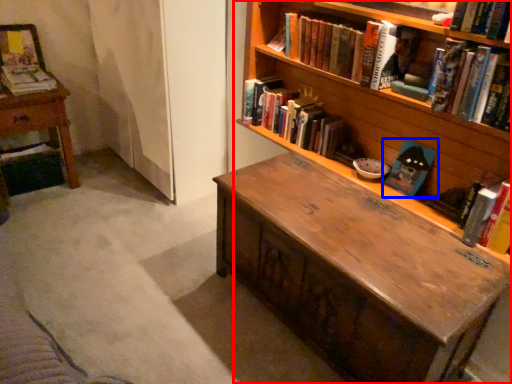
Question: Which object is further to the camera taking this photo, bookcase (highlighted by a red box) or book (highlighted by a blue box)?

Choices:
 (A) bookcase
 (B) book

Answer: (B)